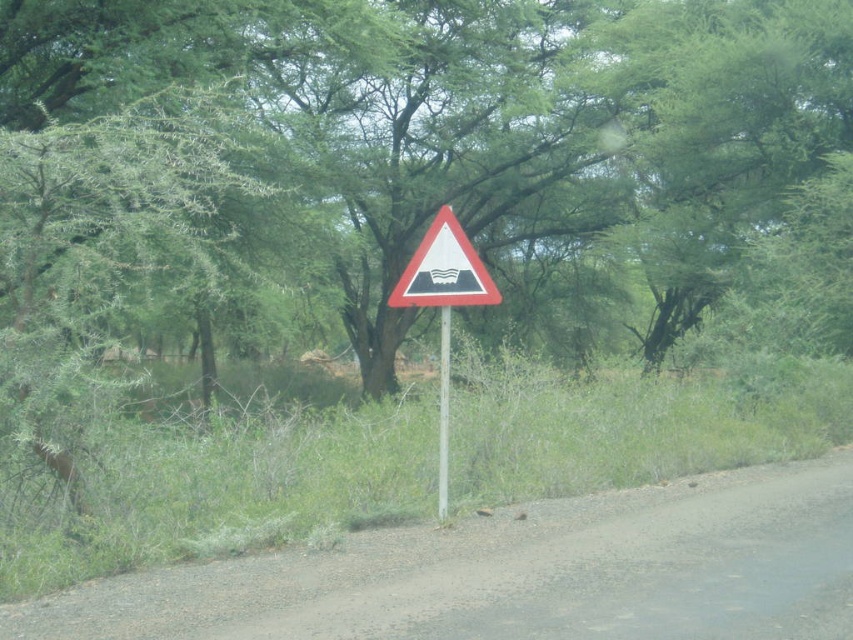
You are a hiker trying to determine the orientation of the sign. Which object is located above the other between the white plastic triangle at center and the white plastic pole at center?

The white plastic triangle at center is positioned over the white plastic pole at center, so the triangle is above the pole.